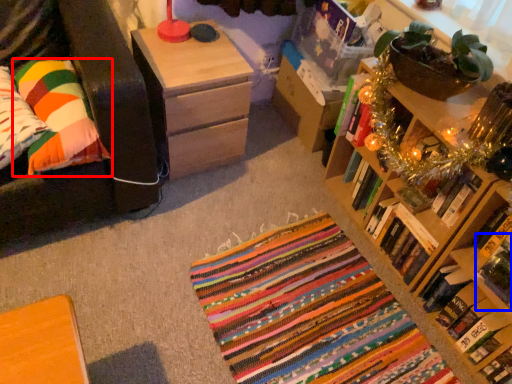
Question: Which point is closer to the camera, pillow (highlighted by a red box) or book (highlighted by a blue box)?

Choices:
 (A) pillow
 (B) book

Answer: (B)